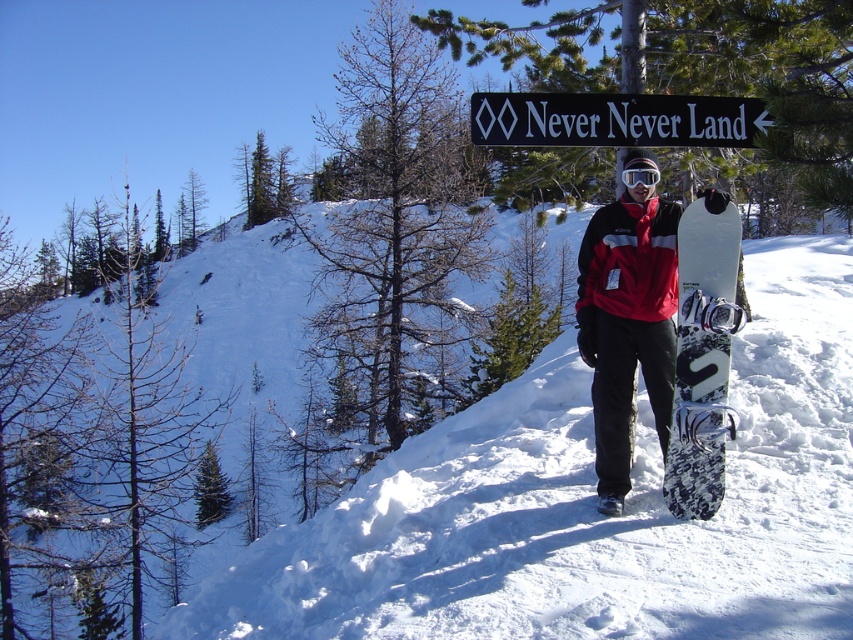
You are planning to take a photo of the snowboarder and the signpost. Since the white fluffy snow at center and the black plastic sign at upper center are both in the frame, which object should you focus on first to ensure both are in focus?

The white fluffy snow at center has a larger width than the black plastic sign at upper center, so you should focus on the white fluffy snow at center first to ensure both are in focus.

You are a drone operator trying to capture a photo of the person on the snowboard. The drone is currently hovering at point 0.5, 0.5. To avoid the white fluffy snow at center, which is located at 0.792, 0.689, you need to adjust the drone to a position that is 0.2 units away from the snow. What should be the new coordinates for the drone?

The white fluffy snow at center is at coordinates (587, 506). To stay 0.2 units away, the drone should be positioned at (416, 378) or (757, 634). However, since the drone is currently at (426, 320), moving it to (416, 378) would keep it closer to the original position while avoiding the snow.